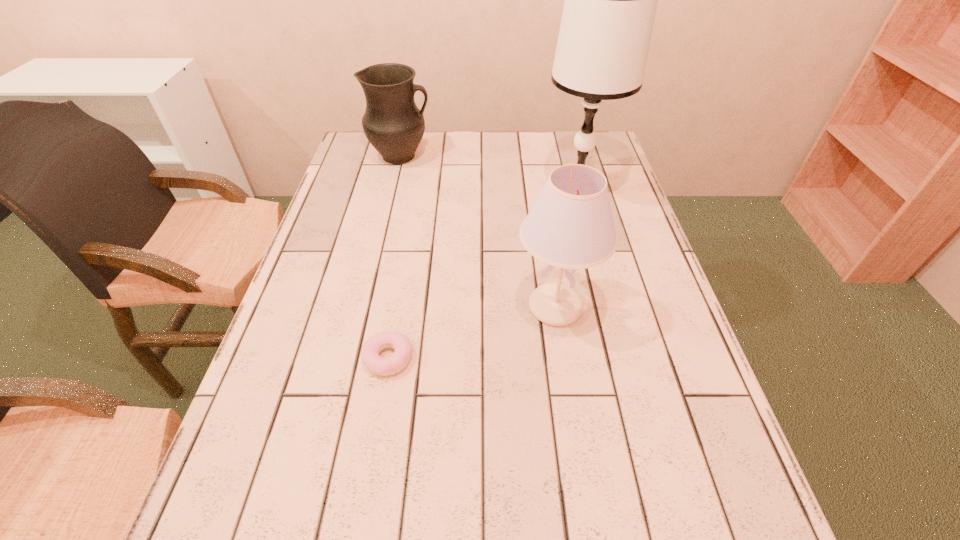
In order to click on free area in between the shortest object and the third tallest object in this screenshot , I will do pos(395,257).

This screenshot has width=960, height=540. I want to click on free space that is in between the pitcher and the doughnut, so point(395,257).

Where is `vacant space in between the tallest object and the doughnut`? vacant space in between the tallest object and the doughnut is located at coordinates (482, 275).

I want to click on object that is the second closest to the third tallest object, so click(x=570, y=225).

Identify which object is the second nearest to the tallest object. Please provide its 2D coordinates. Your answer should be formatted as a tuple, i.e. [(x, y)], where the tuple contains the x and y coordinates of a point satisfying the conditions above.

[(393, 124)]

I want to click on vacant area that satisfies the following two spatial constraints: 1. on the handle side of the third tallest object; 2. on the back side of the table lamp, so click(x=393, y=192).

The width and height of the screenshot is (960, 540). Find the location of `vacant space that satisfies the following two spatial constraints: 1. on the handle side of the pitcher; 2. on the right side of the shortest object`. vacant space that satisfies the following two spatial constraints: 1. on the handle side of the pitcher; 2. on the right side of the shortest object is located at coordinates tap(353, 358).

The width and height of the screenshot is (960, 540). What are the coordinates of `free location that satisfies the following two spatial constraints: 1. on the handle side of the lampshade; 2. on the right side of the third tallest object` in the screenshot? It's located at (366, 307).

Where is `free space that satisfies the following two spatial constraints: 1. on the back side of the shortest object; 2. on the right side of the second tallest object`? Image resolution: width=960 pixels, height=540 pixels. free space that satisfies the following two spatial constraints: 1. on the back side of the shortest object; 2. on the right side of the second tallest object is located at coordinates (396, 307).

I want to click on free space in the image that satisfies the following two spatial constraints: 1. on the back side of the doughnut; 2. on the handle side of the pitcher, so click(x=422, y=156).